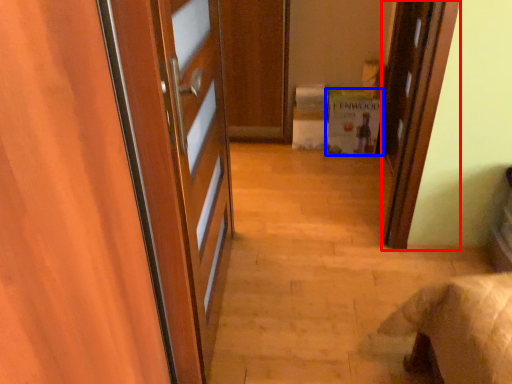
Question: Among these objects, which one is nearest to the camera, door (highlighted by a red box) or cabinetry (highlighted by a blue box)?

Choices:
 (A) door
 (B) cabinetry

Answer: (A)